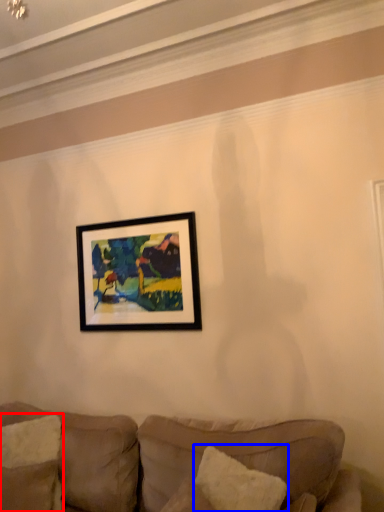
Question: Which of the following is the farthest to the observer, pillow (highlighted by a red box) or pillow (highlighted by a blue box)?

Choices:
 (A) pillow
 (B) pillow

Answer: (A)